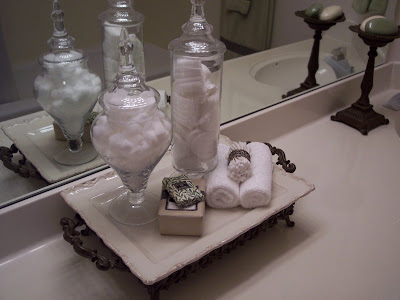
The image size is (400, 300). I want to click on q-tips bundled in a pack, so click(x=241, y=165).